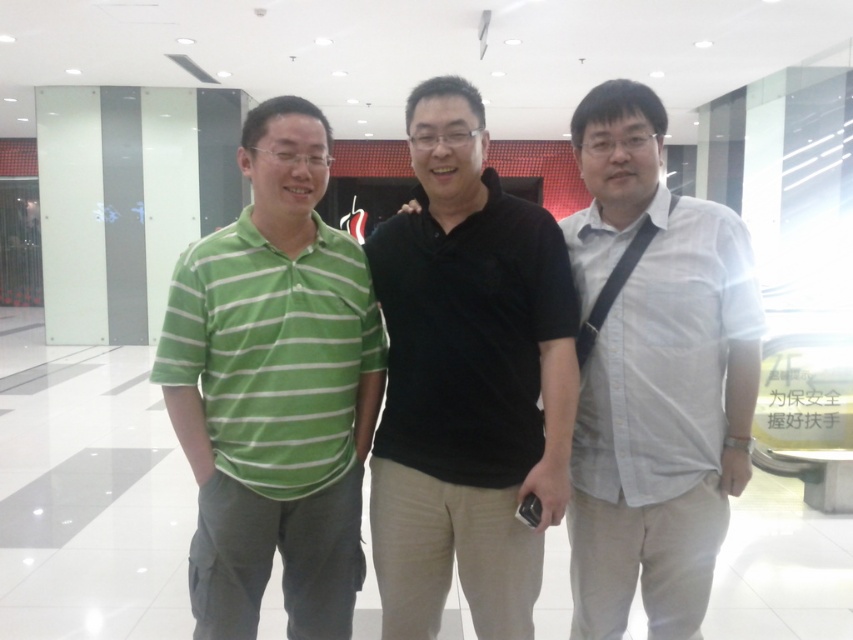
Is black matte shirt at center behind white cotton shirt at right?

No, it is in front of white cotton shirt at right.

Is point (490, 604) positioned in front of point (618, 484)?

Yes, point (490, 604) is in front of point (618, 484).

Is point (547, 372) positioned in front of point (712, 470)?

Yes, point (547, 372) is closer to viewer.

The height and width of the screenshot is (640, 853). In order to click on black matte shirt at center in this screenshot , I will do `click(467, 380)`.

Does point (358, 528) come behind point (677, 307)?

That is True.

Is point (358, 426) less distant than point (618, 369)?

No.

You are a GUI agent. You are given a task and a screenshot of the screen. Output one action in this format:
    pyautogui.click(x=<x>, y=<y>)
    Task: Click on the green striped polo shirt at left
    The width and height of the screenshot is (853, 640).
    Given the screenshot: What is the action you would take?
    pyautogui.click(x=274, y=388)

Does black matte shirt at center appear over green striped polo shirt at left?

Indeed, black matte shirt at center is positioned over green striped polo shirt at left.

Is point (502, 241) positioned before point (247, 248)?

Yes, it is.

Identify the location of black matte shirt at center. The height and width of the screenshot is (640, 853). (467, 380).